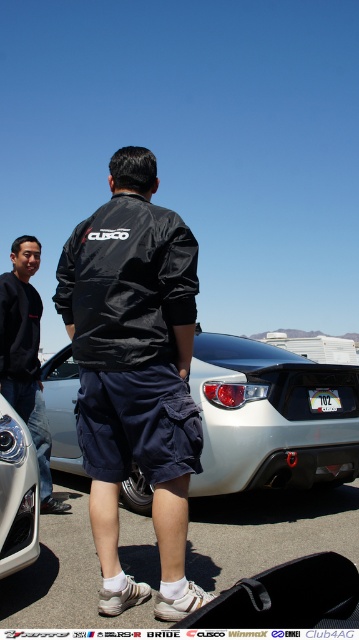
Question: Which of these objects is positioned closest to the white matte car at center?

Choices:
 (A) black leather jacket at center
 (B) black matte jacket at left
 (C) matte silver headlight at lower left

Answer: (A)

Question: Which of the following is the closest to the observer?

Choices:
 (A) (25, 324)
 (B) (334, 406)
 (C) (0, 465)
 (D) (103, 518)

Answer: (C)

Question: Which object is the farthest from the matte silver headlight at lower left?

Choices:
 (A) white matte car at center
 (B) white plastic license plate at rear

Answer: (B)

Question: Can you confirm if black leather jacket at center is bigger than black matte jacket at left?

Choices:
 (A) no
 (B) yes

Answer: (A)

Question: Observing the image, what is the correct spatial positioning of black leather jacket at center in reference to matte silver headlight at lower left?

Choices:
 (A) below
 (B) above

Answer: (B)

Question: Can you confirm if white matte car at center is thinner than black matte jacket at left?

Choices:
 (A) yes
 (B) no

Answer: (B)